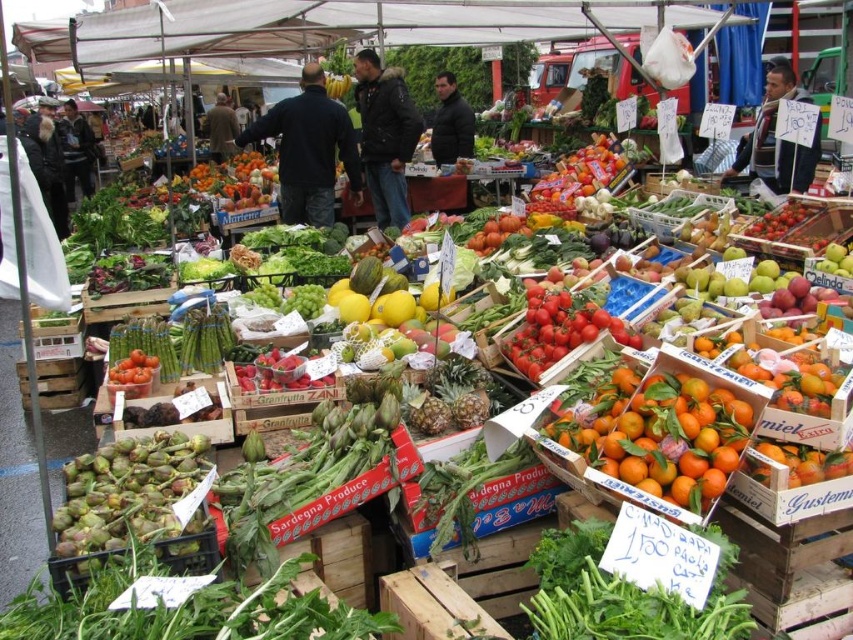
Consider the image. Can you confirm if green leafy at center is wider than yellow matte melon at center?

Incorrect, green leafy at center's width does not surpass yellow matte melon at center's.

Does green leafy at center appear under yellow matte melon at center?

Yes.

You are a GUI agent. You are given a task and a screenshot of the screen. Output one action in this format:
    pyautogui.click(x=<x>, y=<y>)
    Task: Click on the green leafy at center
    Image resolution: width=853 pixels, height=640 pixels.
    Given the screenshot: What is the action you would take?
    pyautogui.click(x=624, y=595)

The height and width of the screenshot is (640, 853). What are the coordinates of `green leafy at center` in the screenshot? It's located at (624, 595).

Which is more to the right, orange matte at center or dark blue jacket at center?

From the viewer's perspective, orange matte at center appears more on the right side.

Is orange matte at center thinner than dark blue jacket at center?

Yes, orange matte at center is thinner than dark blue jacket at center.

The width and height of the screenshot is (853, 640). What are the coordinates of `orange matte at center` in the screenshot? It's located at (660, 435).

Locate an element on the screen. orange matte at center is located at coordinates (660, 435).

Is the position of green matte artichoke at lower left more distant than that of yellow matte melon at center?

No, green matte artichoke at lower left is in front of yellow matte melon at center.

Where is `green matte artichoke at lower left`? This screenshot has height=640, width=853. green matte artichoke at lower left is located at coordinates (134, 502).

The width and height of the screenshot is (853, 640). In order to click on green matte artichoke at lower left in this screenshot , I will do `click(134, 502)`.

Locate an element on the screen. The height and width of the screenshot is (640, 853). green matte artichoke at lower left is located at coordinates (134, 502).